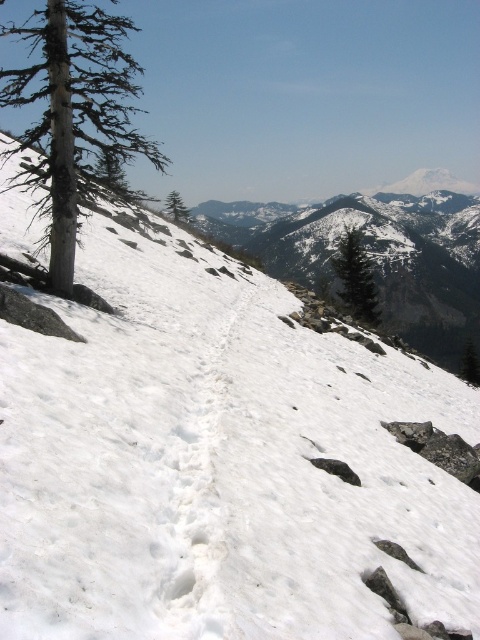
Question: From the image, what is the correct spatial relationship of smooth gray bark tree at left in relation to green matte tree at center?

Choices:
 (A) above
 (B) below

Answer: (A)

Question: Which point appears closest to the camera in this image?

Choices:
 (A) (39, 198)
 (B) (357, 285)
 (C) (180, 212)

Answer: (A)

Question: Which object is positioned closest to the green matte tree at center?

Choices:
 (A) smooth gray bark tree at left
 (B) green matte tree at upper center

Answer: (B)

Question: Is smooth gray bark tree at left smaller than green matte tree at center?

Choices:
 (A) yes
 (B) no

Answer: (B)

Question: Is smooth gray bark tree at left to the left of green matte tree at center from the viewer's perspective?

Choices:
 (A) yes
 (B) no

Answer: (A)

Question: Which object appears closest to the camera in this image?

Choices:
 (A) green matte tree at upper center
 (B) smooth gray bark tree at left
 (C) green matte tree at center

Answer: (B)